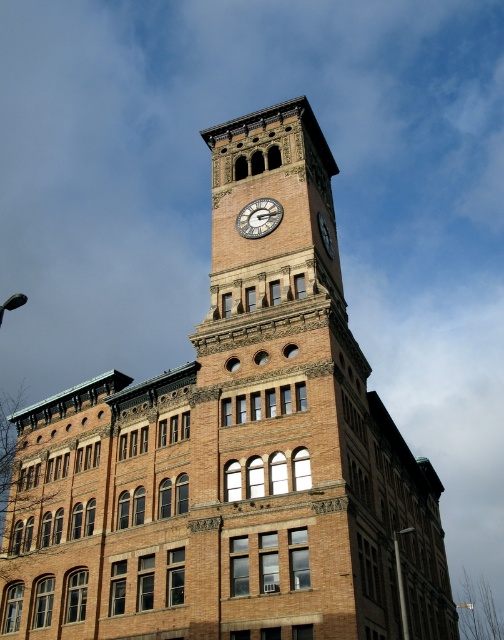
This screenshot has width=504, height=640. What do you see at coordinates (259, 218) in the screenshot? I see `brass clock face at center` at bounding box center [259, 218].

Which is below, brass clock face at center or dark brown stone clock at upper center?

Positioned lower is dark brown stone clock at upper center.

This screenshot has width=504, height=640. What do you see at coordinates (259, 218) in the screenshot?
I see `brass clock face at center` at bounding box center [259, 218].

The height and width of the screenshot is (640, 504). In order to click on brass clock face at center in this screenshot , I will do `click(259, 218)`.